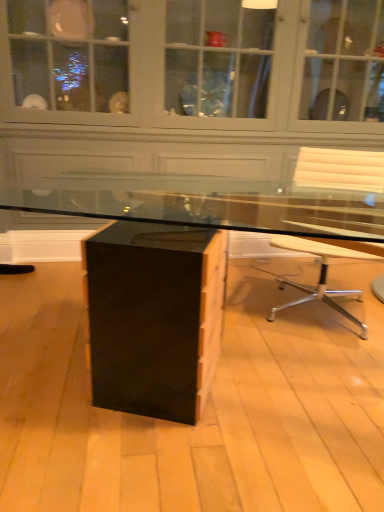
Question: Is matte black desk at center bigger or smaller than black glossy dresser at center?

Choices:
 (A) big
 (B) small

Answer: (B)

Question: Do you think matte black desk at center is within black glossy dresser at center, or outside of it?

Choices:
 (A) outside
 (B) inside

Answer: (A)

Question: Considering the real-world distances, which object is farthest from the white leather chair at right?

Choices:
 (A) black glossy dresser at center
 (B) matte black desk at center

Answer: (A)

Question: Considering the real-world distances, which object is farthest from the black glossy dresser at center?

Choices:
 (A) matte black desk at center
 (B) white leather chair at right

Answer: (A)